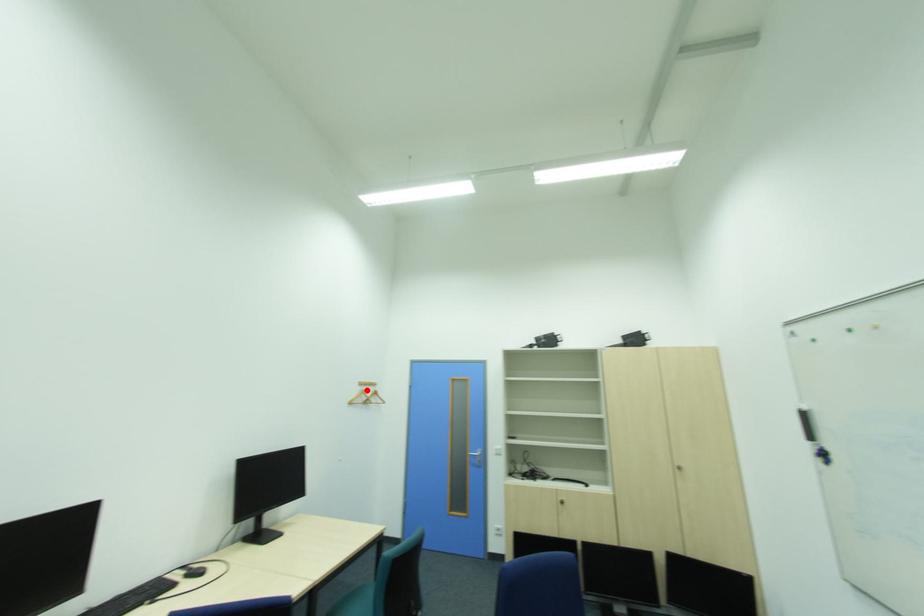
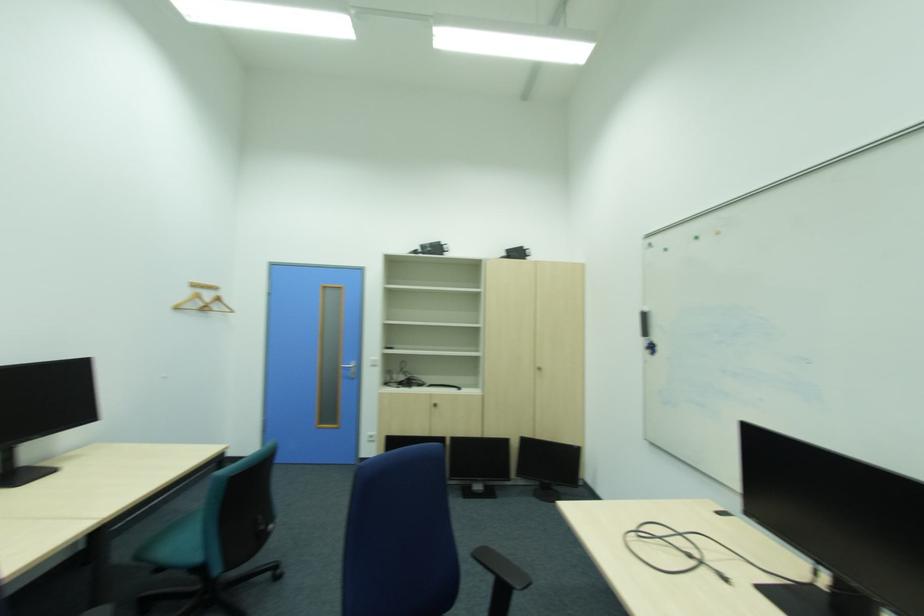
In the second image, find the point that corresponds to the highlighted location in the first image.

(199, 292)